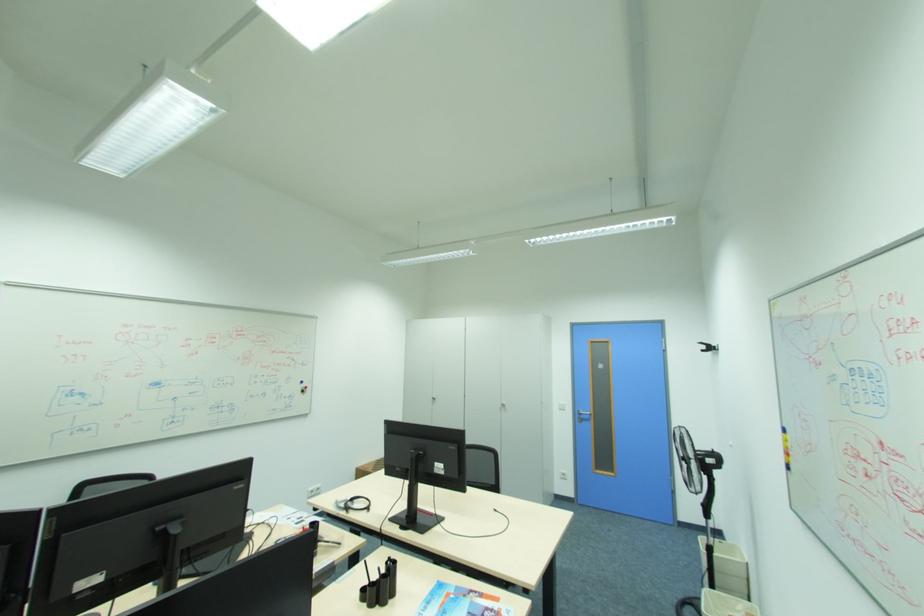
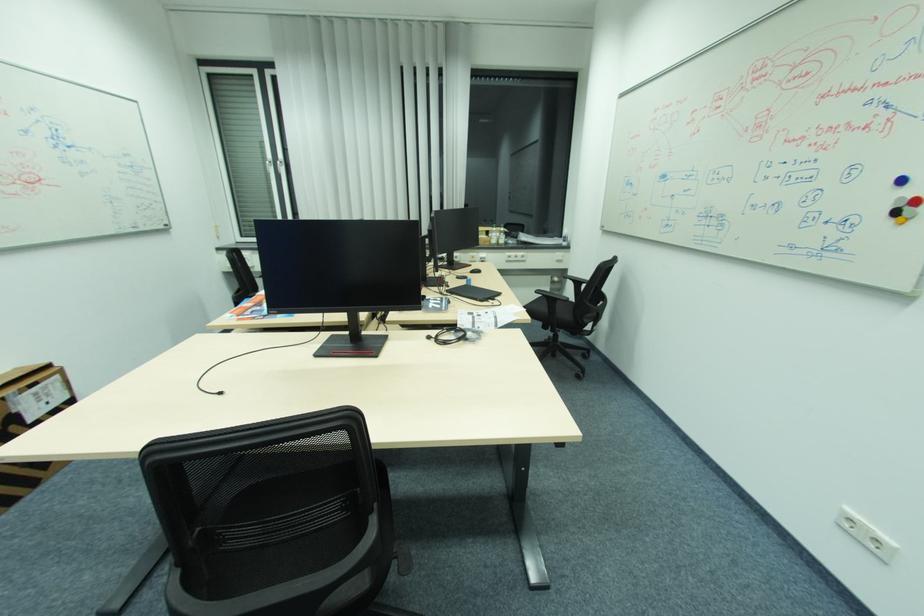
Locate, in the second image, the point that corresponds to pixel 307 382 in the first image.

(908, 180)